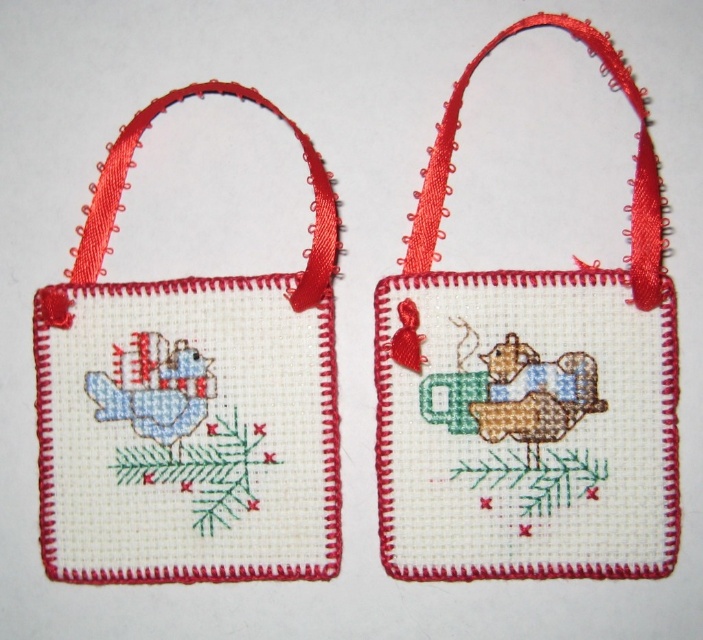
Question: Can you confirm if cross-stitched ornament at center is bigger than white cross-stitch fabric at upper left?

Choices:
 (A) yes
 (B) no

Answer: (A)

Question: Does cross-stitched ornament at center have a larger size compared to white cross-stitch fabric at upper left?

Choices:
 (A) yes
 (B) no

Answer: (A)

Question: Which object is closer to the camera taking this photo?

Choices:
 (A) white cross-stitch fabric at upper left
 (B) cross-stitched ornament at center

Answer: (B)

Question: Observing the image, what is the correct spatial positioning of cross-stitched ornament at center in reference to white cross-stitch fabric at upper left?

Choices:
 (A) above
 (B) below

Answer: (A)

Question: Which point is farther to the camera?

Choices:
 (A) white cross-stitch fabric at upper left
 (B) cross-stitched ornament at center

Answer: (A)